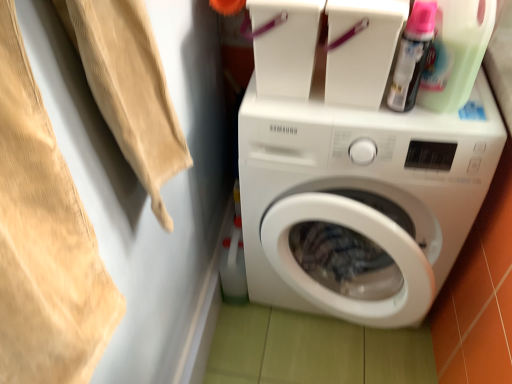
Locate an element on the screen. The image size is (512, 384). vacant area in front of translucent plastic spray can at upper right, the 2th cleaning product positioned from the right is located at coordinates (412, 127).